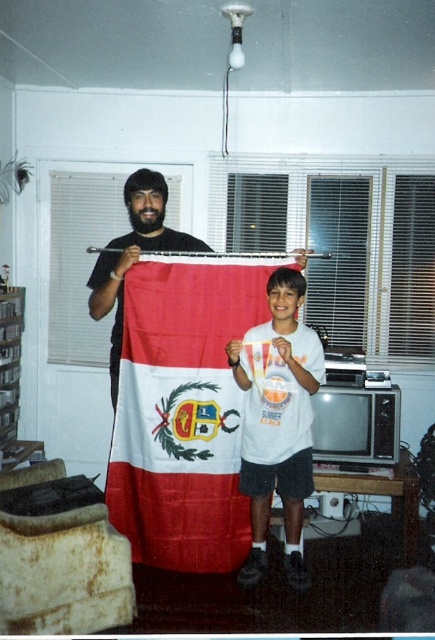
Question: Does white cotton t-shirt at center have a smaller size compared to matte black shirt at left?

Choices:
 (A) yes
 (B) no

Answer: (A)

Question: Where is red and white fabric flag at center located in relation to white cotton t-shirt at center in the image?

Choices:
 (A) above
 (B) below

Answer: (A)

Question: Considering the real-world distances, which object is closest to the red and white fabric flag at center?

Choices:
 (A) matte black shirt at left
 (B) white cotton t-shirt at center

Answer: (B)

Question: Is red and white fabric flag at center smaller than matte black shirt at left?

Choices:
 (A) yes
 (B) no

Answer: (A)

Question: Which object appears farthest from the camera in this image?

Choices:
 (A) white cotton t-shirt at center
 (B) red and white fabric flag at center
 (C) matte black shirt at left

Answer: (B)

Question: Which of the following is the farthest from the observer?

Choices:
 (A) (227, 570)
 (B) (287, 536)
 (C) (180, 232)

Answer: (C)